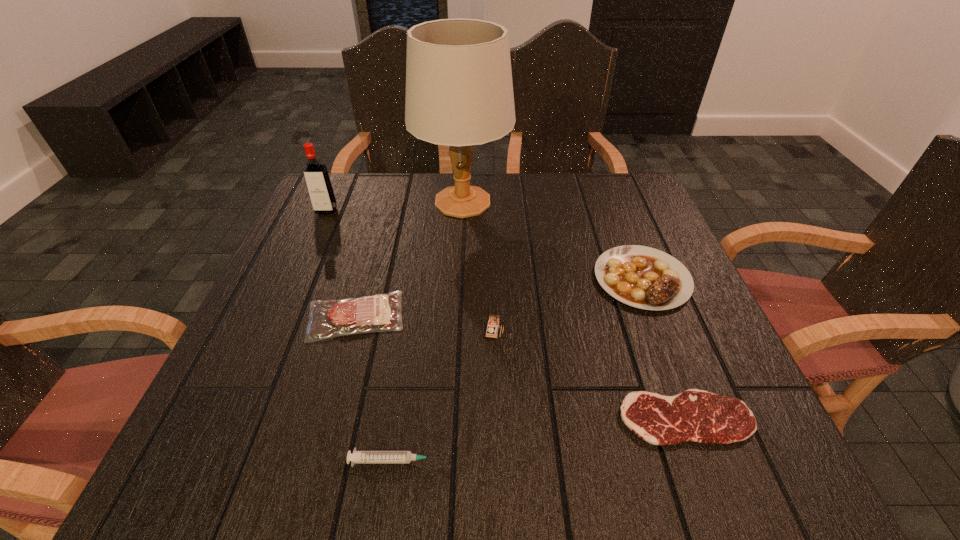
I want to click on unoccupied position between the matchbox and the syringe, so click(445, 394).

Locate which object is the sixth closest to the matchbox. Please provide its 2D coordinates. Your answer should be formatted as a tuple, i.e. [(x, y)], where the tuple contains the x and y coordinates of a point satisfying the conditions above.

[(317, 179)]

This screenshot has width=960, height=540. In order to click on object that is the second closest to the fourth shortest object in this screenshot , I will do pos(695,415).

Locate which steak ranks in proximity to the tallest steak. Please provide its 2D coordinates. Your answer should be formatted as a tuple, i.e. [(x, y)], where the tuple contains the x and y coordinates of a point satisfying the conditions above.

[(695, 415)]

Locate an element on the screen. This screenshot has width=960, height=540. steak that is the closest to the nearest object is located at coordinates (381, 312).

Where is `vacant region that satisfies the following two spatial constraints: 1. on the front and back of the fourth shortest object; 2. on the right side of the sixth shortest object`? The image size is (960, 540). vacant region that satisfies the following two spatial constraints: 1. on the front and back of the fourth shortest object; 2. on the right side of the sixth shortest object is located at coordinates (296, 279).

The image size is (960, 540). Find the location of `free location that satisfies the following two spatial constraints: 1. on the front and back of the fifth shortest object; 2. on the left side of the vodka`. free location that satisfies the following two spatial constraints: 1. on the front and back of the fifth shortest object; 2. on the left side of the vodka is located at coordinates (274, 327).